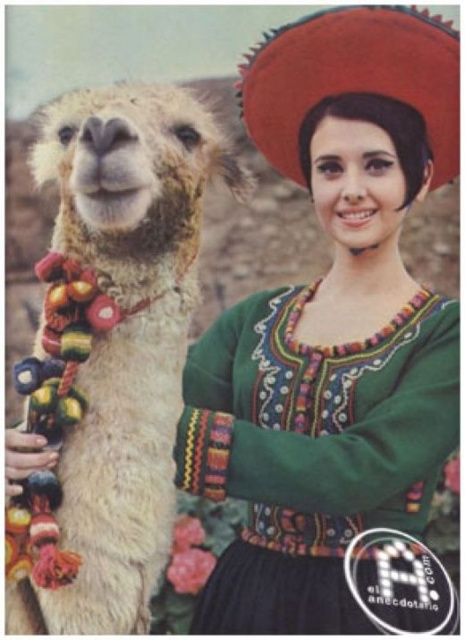
You are a photographer trying to capture the woman and her llama in the image. Since the red felt sombrero at upper right is above the green embroidered dress at center, where should you focus your camera to ensure both are in frame?

To ensure both the red felt sombrero at upper right and the green embroidered dress at center are in frame, focus the camera so that the red felt sombrero at upper right is positioned above the green embroidered dress at center, as described.

You are standing at the point marked as point (53, 544) and want to approach the woman and the llama. Which one is closer to you?

The woman is closer to you than the llama because they are 1.88 meters apart.

You are a photographer trying to capture the entire scene in one shot. You notice the fuzzy white alpaca at left and the red felt sombrero at upper right. Which object takes up more space horizontally in the image?

The red felt sombrero at upper right takes up more horizontal space because the fuzzy white alpaca at left has a lesser width compared to it.